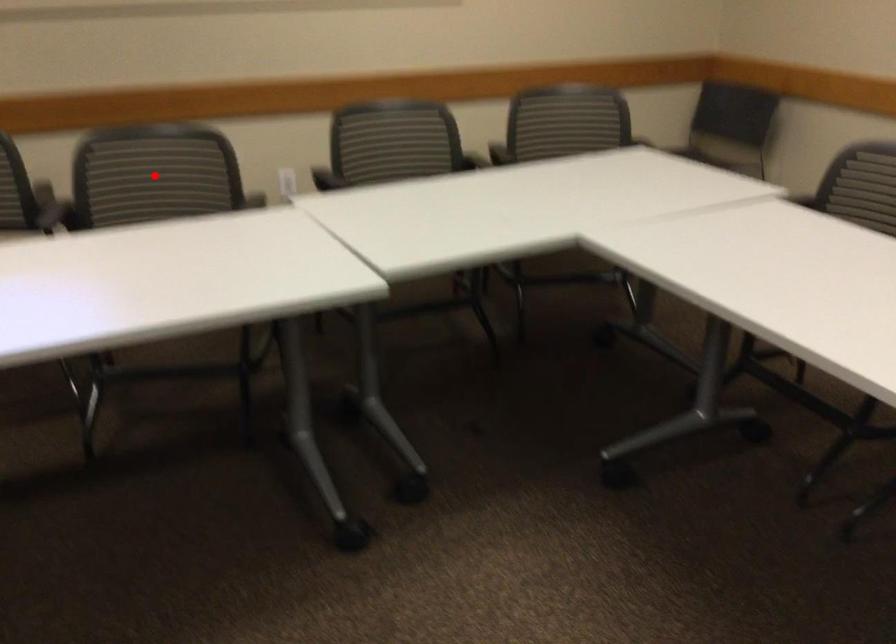
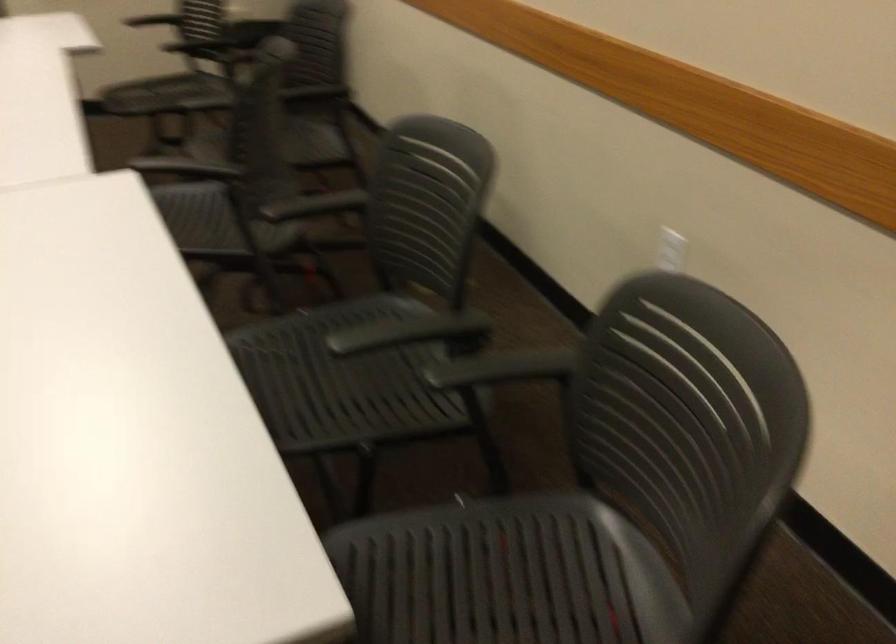
Question: I am providing you with two images of the same scene from different viewpoints. A red point is marked on the first image. Is the red point's position out of view in image 2?

Choices:
 (A) Yes
 (B) No

Answer: (A)